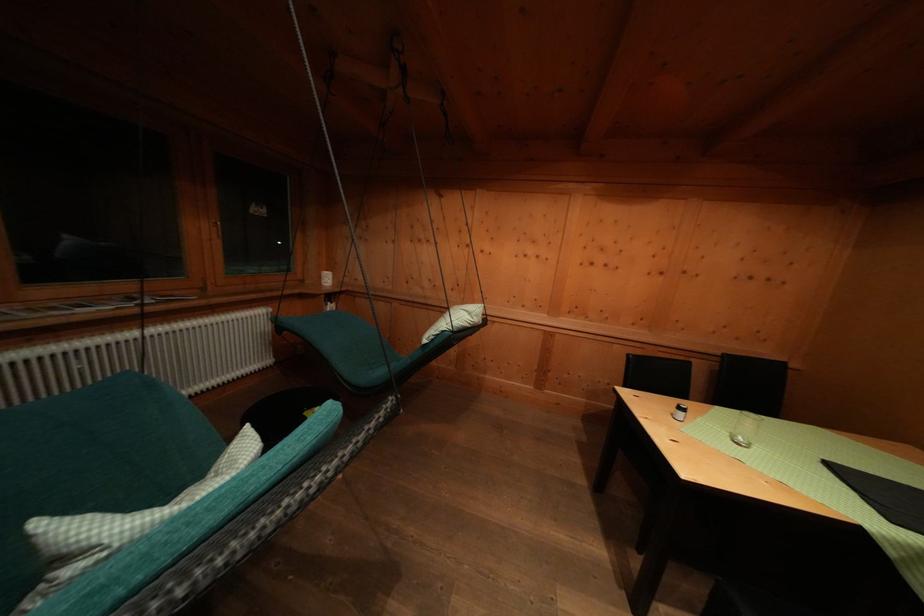
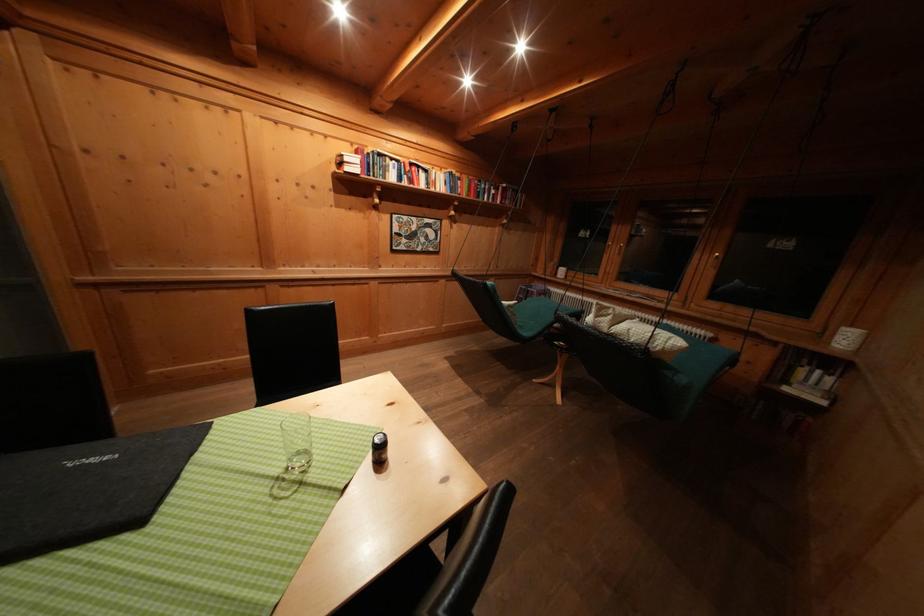
The point at (687, 413) is marked in the first image. Where is the corresponding point in the second image?

(388, 444)